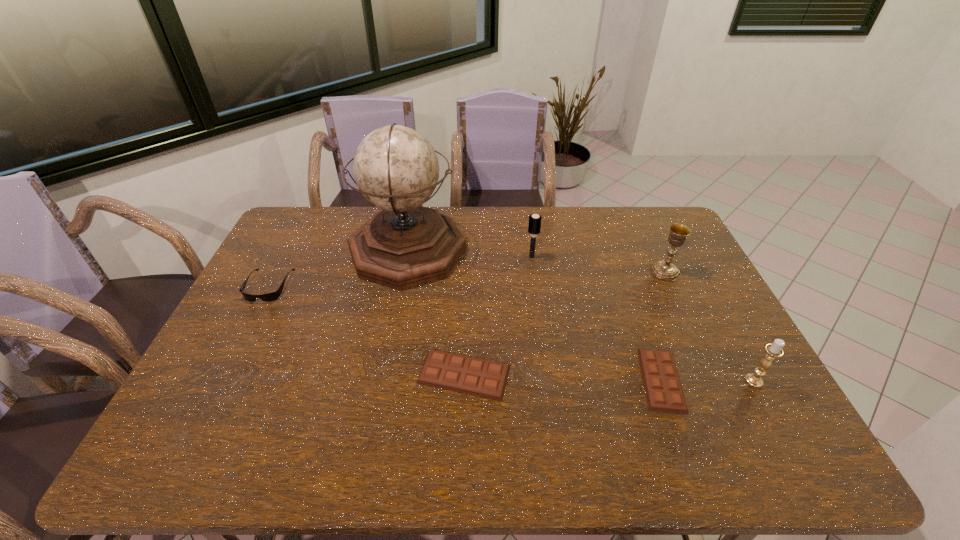
Where is `free space that satisfies the following two spatial constraints: 1. on the back side of the shorter chocolate bar; 2. on the right side of the sixth object from left to right`? The width and height of the screenshot is (960, 540). free space that satisfies the following two spatial constraints: 1. on the back side of the shorter chocolate bar; 2. on the right side of the sixth object from left to right is located at coordinates (622, 271).

You are a GUI agent. You are given a task and a screenshot of the screen. Output one action in this format:
    pyautogui.click(x=<x>, y=<y>)
    Task: Click on the vacant space that satisfies the following two spatial constraints: 1. on the back side of the left chocolate bar; 2. on the surface of the tallest object
    
    Given the screenshot: What is the action you would take?
    pyautogui.click(x=468, y=251)

Image resolution: width=960 pixels, height=540 pixels. What are the coordinates of `vacant space that satisfies the following two spatial constraints: 1. on the surface of the globe; 2. on the right side of the third object from right to left` in the screenshot? It's located at (383, 380).

Identify the location of free space that satisfies the following two spatial constraints: 1. on the front-facing side of the sunglasses; 2. on the left side of the shorter chocolate bar. (220, 380).

You are a GUI agent. You are given a task and a screenshot of the screen. Output one action in this format:
    pyautogui.click(x=<x>, y=<y>)
    Task: Click on the vacant position in the image that satisfies the following two spatial constraints: 1. on the surface of the globe; 2. on the back side of the rightmost object
    This screenshot has height=540, width=960.
    Given the screenshot: What is the action you would take?
    pyautogui.click(x=382, y=381)

At what (x,y) coordinates should I click in order to perform the action: click on vacant position in the image that satisfies the following two spatial constraints: 1. on the surface of the shortest object; 2. on the left side of the tallest object. Please return your answer as a coordinate pair (x, y). Looking at the image, I should click on (383, 380).

Identify the location of vacant space that satisfies the following two spatial constraints: 1. on the surface of the chalice; 2. on the right side of the globe. The height and width of the screenshot is (540, 960). (404, 271).